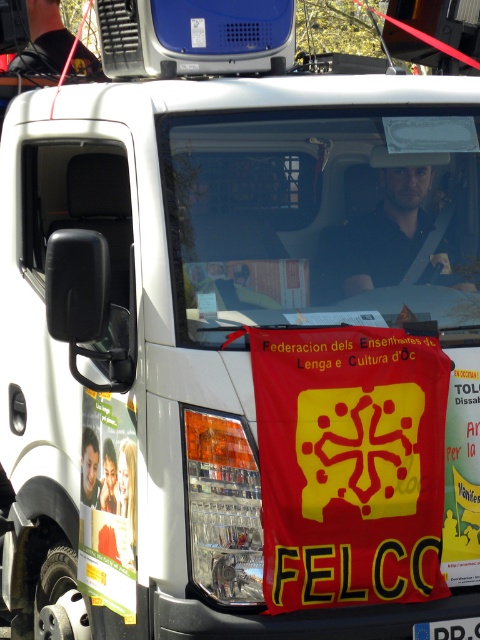
The image size is (480, 640). What do you see at coordinates (193, 36) in the screenshot?
I see `blue plastic speaker at upper center` at bounding box center [193, 36].

From the picture: Is blue plastic speaker at upper center shorter than black fabric at upper center?

Indeed, blue plastic speaker at upper center has a lesser height compared to black fabric at upper center.

Who is more forward, (144, 17) or (48, 3)?

Point (144, 17) is more forward.

Find the location of `blue plastic speaker at upper center`. blue plastic speaker at upper center is located at coordinates (193, 36).

Which is above, blue plastic speaker at upper center or blue plastic license plate at center?

blue plastic speaker at upper center is above.

From the picture: Who is shorter, blue plastic speaker at upper center or blue plastic license plate at center?

With less height is blue plastic license plate at center.

Find the location of a particular element. This screenshot has width=480, height=640. blue plastic speaker at upper center is located at coordinates (193, 36).

The height and width of the screenshot is (640, 480). I want to click on black fabric at upper center, so click(51, 44).

Does black fabric at upper center appear on the right side of blue plastic license plate at center?

In fact, black fabric at upper center is to the left of blue plastic license plate at center.

The image size is (480, 640). In order to click on black fabric at upper center in this screenshot , I will do `click(51, 44)`.